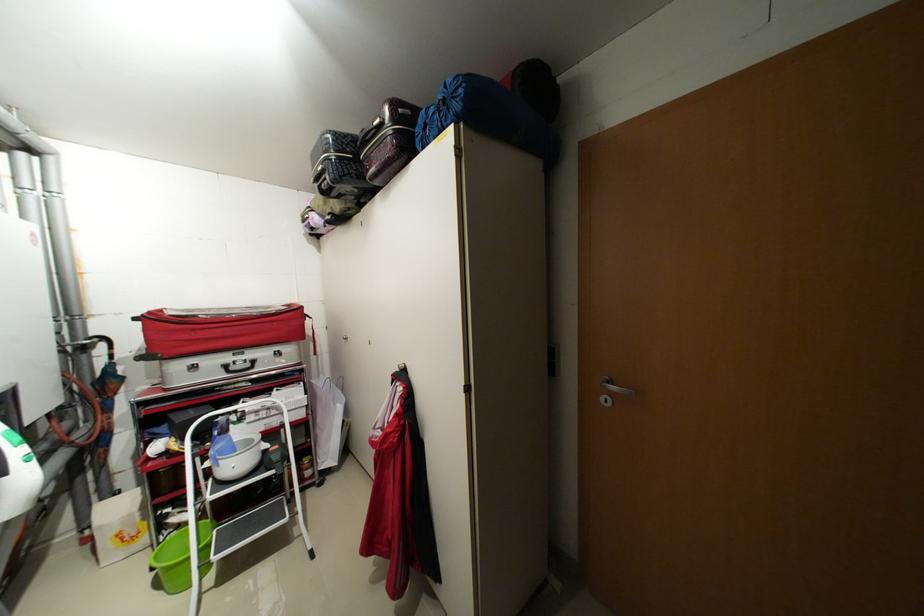
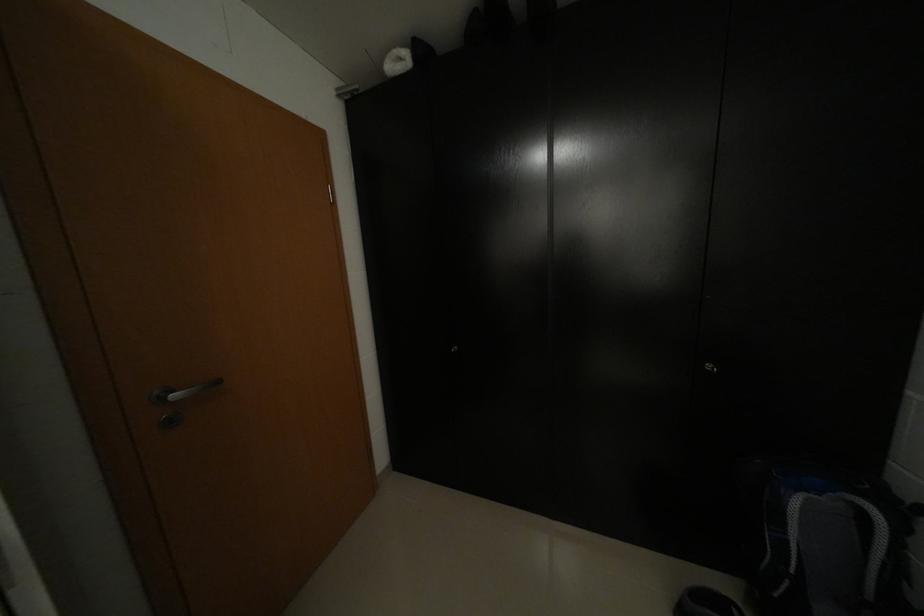
Question: The first image is from the beginning of the video and the second image is from the end. How did the camera likely rotate when shooting the video?

Choices:
 (A) Left
 (B) Right
 (C) Up
 (D) Down

Answer: (B)